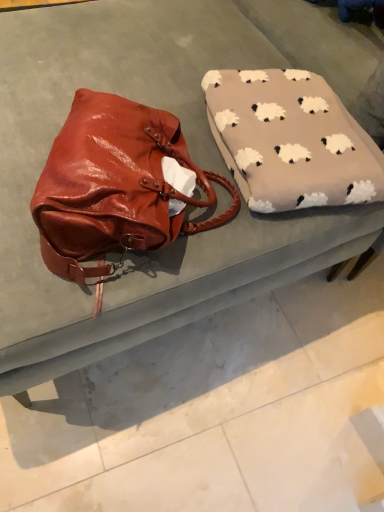
Locate an element on the screen. Image resolution: width=384 pixels, height=512 pixels. matte leather bag at left is located at coordinates (212, 412).

This screenshot has height=512, width=384. What do you see at coordinates (212, 412) in the screenshot?
I see `matte leather bag at left` at bounding box center [212, 412].

At what (x,y) coordinates should I click in order to perform the action: click on matte leather bag at left. Please return your answer as a coordinate pair (x, y). This screenshot has height=512, width=384. Looking at the image, I should click on (212, 412).